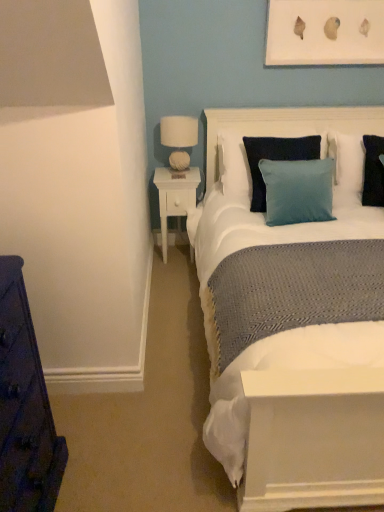
Where is `black matte pillow at right, the second pillow when ordered from back to front`? The height and width of the screenshot is (512, 384). black matte pillow at right, the second pillow when ordered from back to front is located at coordinates (373, 170).

What is the approximate height of black matte pillow at right, placed as the first pillow when sorted from front to back?

It is 20.97 inches.

Measure the distance between white fabric headboard at upper center and camera.

The distance of white fabric headboard at upper center from camera is 2.73 meters.

Where is `blue fabric pillow at upper right, the 1th pillow viewed from the back`? The image size is (384, 512). blue fabric pillow at upper right, the 1th pillow viewed from the back is located at coordinates (359, 166).

Locate an element on the screen. The height and width of the screenshot is (512, 384). white matte picture frame at upper center is located at coordinates (325, 32).

Locate an element on the screen. The image size is (384, 512). white fabric lampshade at upper right is located at coordinates (179, 138).

From the image's perspective, between white fabric headboard at upper center and blue fabric pillow at upper right, marked as the 2th pillow in a front-to-back arrangement, which one is located above?

white fabric headboard at upper center, from the image's perspective.

Measure the distance from white fabric headboard at upper center to blue fabric pillow at upper right, the 1th pillow viewed from the back.

12.92 inches.

Is white fabric headboard at upper center oriented away from blue fabric pillow at upper right, marked as the 2th pillow in a front-to-back arrangement?

No, white fabric headboard at upper center is not facing the opposite direction of blue fabric pillow at upper right, marked as the 2th pillow in a front-to-back arrangement.

How many degrees apart are the facing directions of white fabric headboard at upper center and blue fabric pillow at upper right, marked as the 2th pillow in a front-to-back arrangement?

white fabric headboard at upper center and blue fabric pillow at upper right, marked as the 2th pillow in a front-to-back arrangement, are facing 0.000172 degrees away from each other.

From a real-world perspective, who is located higher, white wood nightstand at center-left or white fabric lampshade at upper right?

From a 3D spatial view, white fabric lampshade at upper right is above.

At what (x,y) coordinates should I click in order to perform the action: click on table lamp located above the white wood nightstand at center-left (from the image's perspective). Please return your answer as a coordinate pair (x, y). The width and height of the screenshot is (384, 512). Looking at the image, I should click on (179, 138).

Visually, is white wood nightstand at center-left positioned to the left or to the right of white fabric lampshade at upper right?

Based on their positions, white wood nightstand at center-left is located to the left of white fabric lampshade at upper right.

Does white wood nightstand at center-left have a larger size compared to white fabric lampshade at upper right?

Yes.

Can you confirm if black matte pillow at right, placed as the first pillow when sorted from front to back, is smaller than white fabric headboard at upper center?

Yes.

Is black matte pillow at right, placed as the first pillow when sorted from front to back, wider than white fabric headboard at upper center?

Correct, the width of black matte pillow at right, placed as the first pillow when sorted from front to back, exceeds that of white fabric headboard at upper center.

From a real-world perspective, is black matte pillow at right, the second pillow when ordered from back to front, above or below white fabric headboard at upper center?

From a real-world perspective, black matte pillow at right, the second pillow when ordered from back to front, is physically below white fabric headboard at upper center.

Considering the relative sizes of black matte pillow at right, placed as the first pillow when sorted from front to back, and white wood nightstand at center-left in the image provided, is black matte pillow at right, placed as the first pillow when sorted from front to back, taller than white wood nightstand at center-left?

No, black matte pillow at right, placed as the first pillow when sorted from front to back, is not taller than white wood nightstand at center-left.

Is point (371, 152) closer or farther from the camera than point (173, 205)?

Point (371, 152).

Considering the relative sizes of black matte pillow at right, the second pillow when ordered from back to front, and white wood nightstand at center-left in the image provided, is black matte pillow at right, the second pillow when ordered from back to front, thinner than white wood nightstand at center-left?

No, black matte pillow at right, the second pillow when ordered from back to front, is not thinner than white wood nightstand at center-left.

Does black matte pillow at right, placed as the first pillow when sorted from front to back, appear on the right side of white wood nightstand at center-left?

Yes, black matte pillow at right, placed as the first pillow when sorted from front to back, is to the right of white wood nightstand at center-left.

Is white fabric headboard at upper center inside blue fabric pillow at upper right, the 1th pillow viewed from the back?

Definitely not — white fabric headboard at upper center is not inside blue fabric pillow at upper right, the 1th pillow viewed from the back.

Is blue fabric pillow at upper right, the 1th pillow viewed from the back, to the right of white fabric headboard at upper center from the viewer's perspective?

Indeed, blue fabric pillow at upper right, the 1th pillow viewed from the back, is positioned on the right side of white fabric headboard at upper center.

From the image's perspective, count 1st pillows downward from the white fabric headboard at upper center and point to it. Please provide its 2D coordinates.

[(359, 166)]

Considering the relative positions of white fabric headboard at upper center and white matte picture frame at upper center in the image provided, is white fabric headboard at upper center to the left or to the right of white matte picture frame at upper center?

Clearly, white fabric headboard at upper center is on the left of white matte picture frame at upper center in the image.

Would you consider white fabric headboard at upper center to be distant from white matte picture frame at upper center?

No, there isn't a large distance between white fabric headboard at upper center and white matte picture frame at upper center.

How many degrees apart are the facing directions of white fabric headboard at upper center and white matte picture frame at upper center?

The angular difference between white fabric headboard at upper center and white matte picture frame at upper center is 0.404 degrees.

Considering the relative positions of blue fabric pillow at upper right, marked as the 2th pillow in a front-to-back arrangement, and white fabric lampshade at upper right in the image provided, is blue fabric pillow at upper right, marked as the 2th pillow in a front-to-back arrangement, to the right of white fabric lampshade at upper right from the viewer's perspective?

Correct, you'll find blue fabric pillow at upper right, marked as the 2th pillow in a front-to-back arrangement, to the right of white fabric lampshade at upper right.

How different are the orientations of blue fabric pillow at upper right, the 1th pillow viewed from the back, and white fabric lampshade at upper right in degrees?

The facing directions of blue fabric pillow at upper right, the 1th pillow viewed from the back, and white fabric lampshade at upper right are 1.78 degrees apart.

This screenshot has width=384, height=512. I want to click on table lamp behind the blue fabric pillow at upper right, the 1th pillow viewed from the back, so click(179, 138).

Is white fabric lampshade at upper right at the back of blue fabric pillow at upper right, marked as the 2th pillow in a front-to-back arrangement?

No, blue fabric pillow at upper right, marked as the 2th pillow in a front-to-back arrangement, is not facing away from white fabric lampshade at upper right.

Locate an element on the screen. This screenshot has height=512, width=384. headboard lying behind the blue fabric pillow at upper right, the 1th pillow viewed from the back is located at coordinates (286, 125).

There is a white wood nightstand at center-left. Where is `table lamp above it (from a real-world perspective)`? The height and width of the screenshot is (512, 384). table lamp above it (from a real-world perspective) is located at coordinates (179, 138).

Which object lies further to the anchor point white wood nightstand at center-left, white fabric lampshade at upper right or blue fabric pillow at upper right, marked as the 2th pillow in a front-to-back arrangement?

blue fabric pillow at upper right, marked as the 2th pillow in a front-to-back arrangement.

Based on the photo, from the image, which object appears to be farther from black matte pillow at right, placed as the first pillow when sorted from front to back, white matte picture frame at upper center or white wood nightstand at center-left?

Among the two, white wood nightstand at center-left is located further to black matte pillow at right, placed as the first pillow when sorted from front to back.

Estimate the real-world distances between objects in this image. Which object is further from blue fabric pillow at upper right, the 1th pillow viewed from the back, white matte picture frame at upper center or black matte pillow at right, placed as the first pillow when sorted from front to back?

The object further to blue fabric pillow at upper right, the 1th pillow viewed from the back, is white matte picture frame at upper center.

From the picture: Considering their positions, is white matte picture frame at upper center positioned closer to white fabric lampshade at upper right than white wood nightstand at center-left?

Based on the image, white wood nightstand at center-left appears to be nearer to white fabric lampshade at upper right.

Looking at the image, which one is located further to black matte pillow at right, placed as the first pillow when sorted from front to back, white fabric lampshade at upper right or white fabric headboard at upper center?

white fabric lampshade at upper right.

Estimate the real-world distances between objects in this image. Which object is further from white fabric headboard at upper center, white wood nightstand at center-left or white matte picture frame at upper center?

white wood nightstand at center-left lies further to white fabric headboard at upper center than the other object.

When comparing their distances from white wood nightstand at center-left, does blue fabric pillow at upper right, marked as the 2th pillow in a front-to-back arrangement, or white matte picture frame at upper center seem further?

white matte picture frame at upper center.

From the image, which object appears to be farther from white fabric lampshade at upper right, black matte pillow at right, the second pillow when ordered from back to front, or white matte picture frame at upper center?

black matte pillow at right, the second pillow when ordered from back to front, lies further to white fabric lampshade at upper right than the other object.

This screenshot has width=384, height=512. I want to click on headboard between white fabric lampshade at upper right and black matte pillow at right, the second pillow when ordered from back to front, in the horizontal direction, so click(x=286, y=125).

You are a GUI agent. You are given a task and a screenshot of the screen. Output one action in this format:
    pyautogui.click(x=<x>, y=<y>)
    Task: Click on the headboard situated between white wood nightstand at center-left and blue fabric pillow at upper right, marked as the 2th pillow in a front-to-back arrangement, from left to right
    The height and width of the screenshot is (512, 384).
    Given the screenshot: What is the action you would take?
    pyautogui.click(x=286, y=125)

Where is `pillow between white matte picture frame at upper center and black matte pillow at right, placed as the first pillow when sorted from front to back, from top to bottom`? The image size is (384, 512). pillow between white matte picture frame at upper center and black matte pillow at right, placed as the first pillow when sorted from front to back, from top to bottom is located at coordinates (359, 166).

Identify the location of headboard that lies between white matte picture frame at upper center and black matte pillow at right, placed as the first pillow when sorted from front to back, from top to bottom. This screenshot has height=512, width=384. (286, 125).